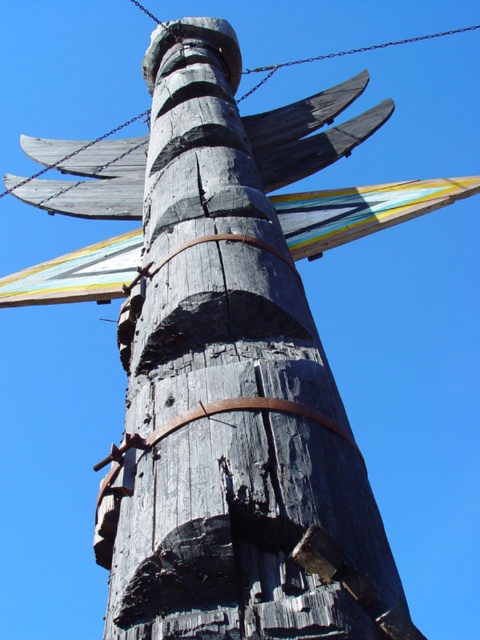
Question: Which object appears closest to the camera in this image?

Choices:
 (A) metallic chain at upper center
 (B) charcoal wood totem pole at center

Answer: (B)

Question: Does charcoal wood totem pole at center have a larger size compared to metallic chain at upper center?

Choices:
 (A) no
 (B) yes

Answer: (A)

Question: Does charcoal wood totem pole at center lie behind metallic chain at upper center?

Choices:
 (A) yes
 (B) no

Answer: (B)

Question: Which object appears closest to the camera in this image?

Choices:
 (A) metallic chain at upper center
 (B) charcoal wood totem pole at center

Answer: (B)

Question: Can you confirm if charcoal wood totem pole at center is bigger than metallic chain at upper center?

Choices:
 (A) no
 (B) yes

Answer: (A)